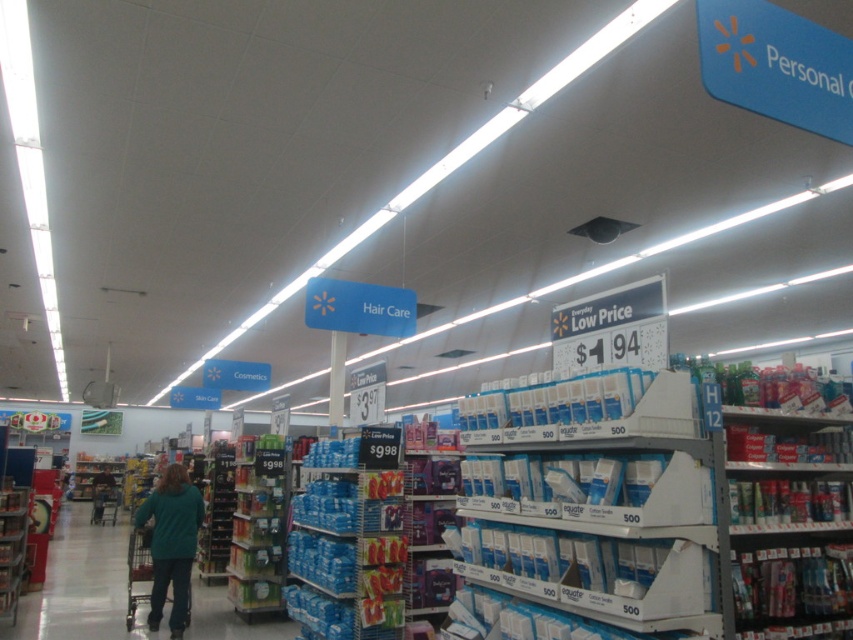
Question: Which of the following is the farthest from the observer?

Choices:
 (A) (445, 536)
 (B) (180, 525)
 (C) (334, 316)
 (D) (3, 552)

Answer: (C)

Question: Estimate the real-world distances between objects in this image. Which object is closer to the teal fabric shirt at center?

Choices:
 (A) blue plastic sign at upper center
 (B) blue plastic shelf at lower left

Answer: (B)

Question: Does white cardboard boxes at center lie behind blue plastic shelf at lower left?

Choices:
 (A) yes
 (B) no

Answer: (B)

Question: Is teal fabric shirt at center positioned at the back of blue plastic shelf at lower left?

Choices:
 (A) yes
 (B) no

Answer: (B)

Question: Which object is positioned farthest from the white cardboard boxes at center?

Choices:
 (A) blue plastic shelf at lower left
 (B) teal fabric shirt at center
 (C) blue plastic sign at upper center

Answer: (A)

Question: Is white cardboard boxes at center closer to camera compared to teal fabric shirt at center?

Choices:
 (A) no
 (B) yes

Answer: (B)